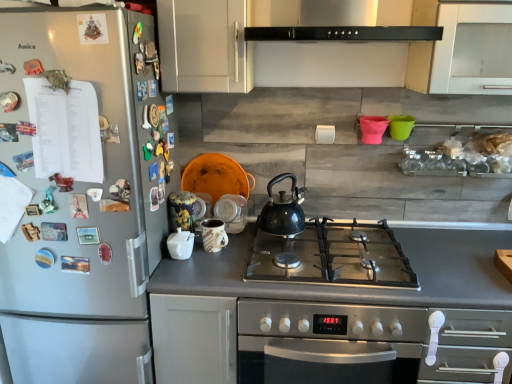
Question: Should I look upward or downward to see stainless steel oven at center?

Choices:
 (A) up
 (B) down

Answer: (B)

Question: Is black matte kettle at center thinner than matte ceramic mug at center, which is the 2th appliance from front to back?

Choices:
 (A) yes
 (B) no

Answer: (B)

Question: Does black matte kettle at center appear on the left side of matte ceramic mug at center, which is the 2th appliance from front to back?

Choices:
 (A) no
 (B) yes

Answer: (A)

Question: From the image's perspective, would you say black matte kettle at center is shown under matte ceramic mug at center, which is the 2th appliance from front to back?

Choices:
 (A) no
 (B) yes

Answer: (A)

Question: From a real-world perspective, is black matte kettle at center positioned over matte ceramic mug at center, which is the 2th appliance from front to back, based on gravity?

Choices:
 (A) yes
 (B) no

Answer: (A)

Question: Can you confirm if black matte kettle at center is smaller than matte ceramic mug at center, which is counted as the second appliance, starting from the back?

Choices:
 (A) yes
 (B) no

Answer: (B)

Question: Is black matte kettle at center at the right side of matte ceramic mug at center, which is the 2th appliance from front to back?

Choices:
 (A) yes
 (B) no

Answer: (A)

Question: Can you confirm if white glossy sugar bowl at center, positioned as the third appliance in back-to-front order, is shorter than white matte cabinet at upper center?

Choices:
 (A) no
 (B) yes

Answer: (B)

Question: From the image's perspective, is white glossy sugar bowl at center, positioned as the third appliance in back-to-front order, beneath white matte cabinet at upper center?

Choices:
 (A) yes
 (B) no

Answer: (A)

Question: Is white glossy sugar bowl at center, positioned as the third appliance in back-to-front order, thinner than white matte cabinet at upper center?

Choices:
 (A) no
 (B) yes

Answer: (B)

Question: Are white glossy sugar bowl at center, positioned as the third appliance in back-to-front order, and white matte cabinet at upper center making contact?

Choices:
 (A) no
 (B) yes

Answer: (A)

Question: Can you confirm if white glossy sugar bowl at center, marked as the first appliance in a front-to-back arrangement, is smaller than white matte cabinet at upper center?

Choices:
 (A) yes
 (B) no

Answer: (A)

Question: Does white glossy sugar bowl at center, marked as the first appliance in a front-to-back arrangement, turn towards white matte cabinet at upper center?

Choices:
 (A) yes
 (B) no

Answer: (B)

Question: Is matte ceramic mug at center, which is counted as the second appliance, starting from the back, not near stainless steel oven at center?

Choices:
 (A) yes
 (B) no

Answer: (B)